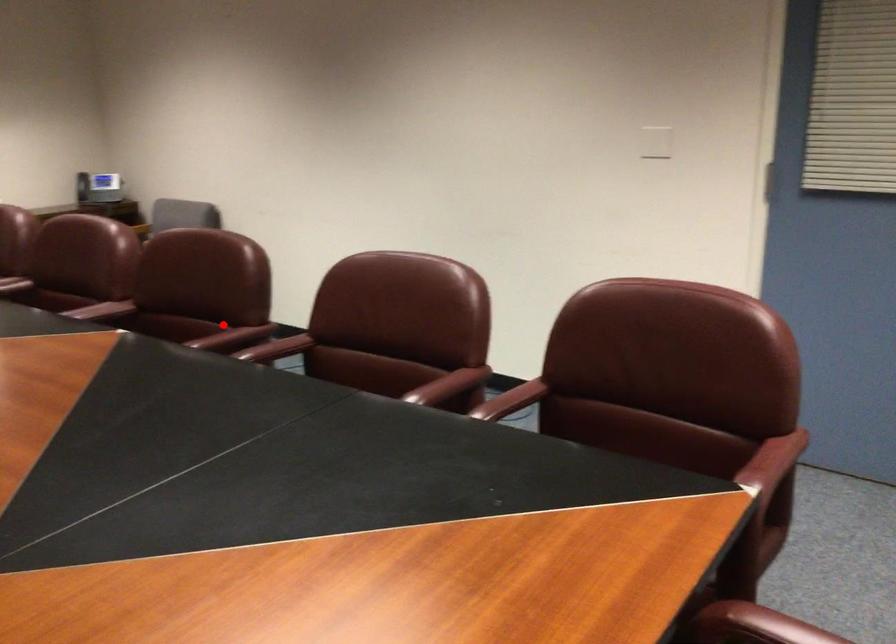
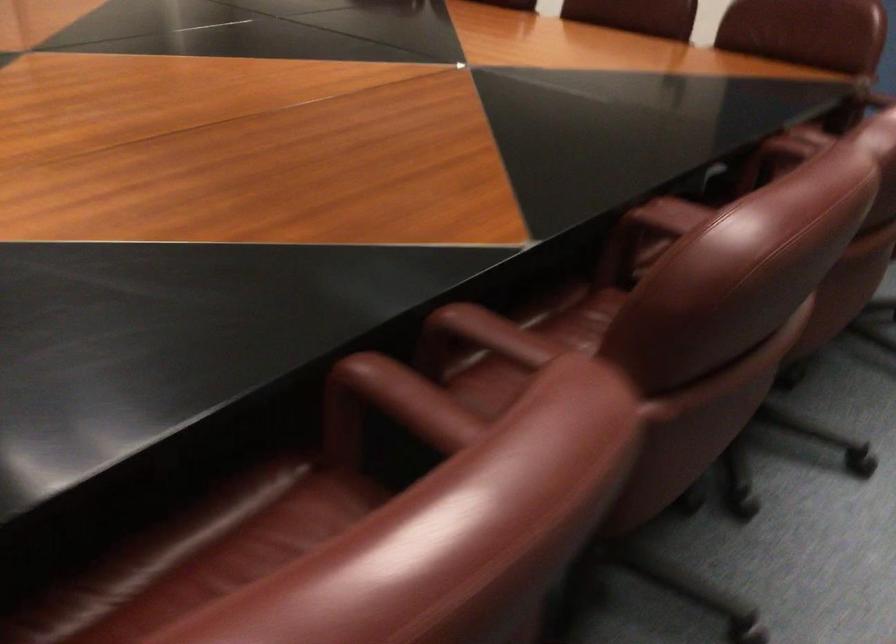
Locate, in the second image, the point that corresponds to the highlighted location in the first image.

(528, 344)